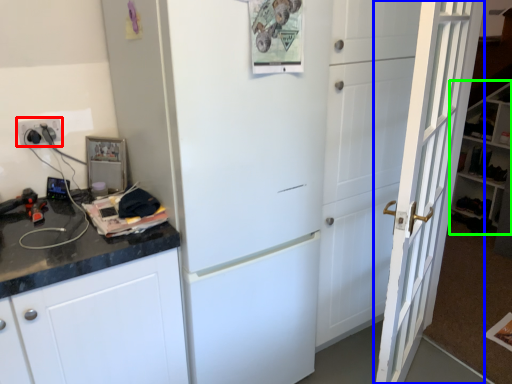
Question: Which object is positioned closest to electric outlet (highlighted by a red box)? Select from door (highlighted by a blue box) and bookshelf (highlighted by a green box).

Choices:
 (A) door
 (B) bookshelf

Answer: (A)